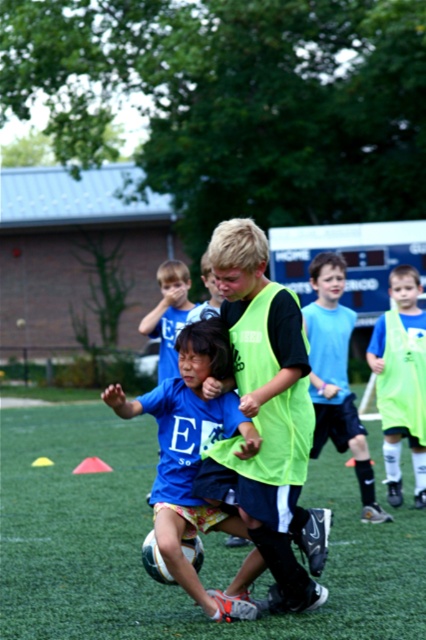
Is neon green jersey at center thinner than neon green vest at right?

In fact, neon green jersey at center might be wider than neon green vest at right.

Can you confirm if neon green jersey at center is positioned to the right of neon green vest at right?

Incorrect, neon green jersey at center is not on the right side of neon green vest at right.

I want to click on neon green jersey at center, so click(x=268, y=410).

Where is `neon green jersey at center`? neon green jersey at center is located at coordinates (268, 410).

Which is more to the right, neon green jersey at center or light blue jersey at center?

From the viewer's perspective, light blue jersey at center appears more on the right side.

Is neon green jersey at center below light blue jersey at center?

Indeed, neon green jersey at center is positioned under light blue jersey at center.

Between point (301, 540) and point (340, 378), which one is positioned behind?

The point (340, 378) is more distant.

Where is `neon green jersey at center`? The width and height of the screenshot is (426, 640). neon green jersey at center is located at coordinates (268, 410).

Is neon green vest at right above light blue jersey at center?

No, neon green vest at right is not above light blue jersey at center.

Which is above, neon green vest at right or light blue jersey at center?

light blue jersey at center

Locate an element on the screen. The height and width of the screenshot is (640, 426). neon green vest at right is located at coordinates (402, 380).

Locate an element on the screen. neon green vest at right is located at coordinates (402, 380).